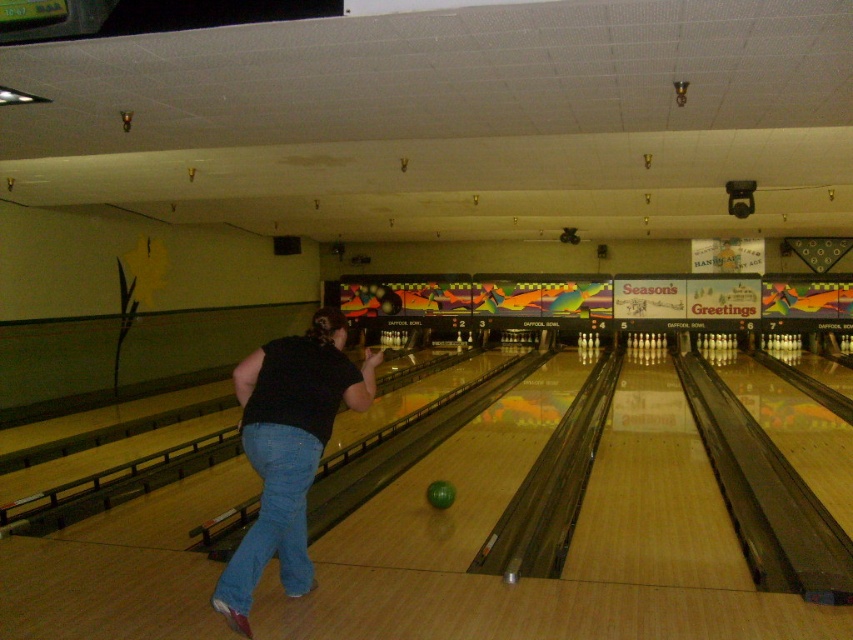
You are standing at the entrance of the bowling alley and see the point marked at coordinates (288, 449). What object is located at that point?

The point at coordinates (288, 449) corresponds to the black cotton shirt at center.

Based on the photo, you are a photographer standing at the end of the bowling lane. You notice the denim at left and the green matte bowling ball at center in your viewfinder. Which object should you zoom in on if you want to capture the larger object in detail?

The denim at left is larger than the green matte bowling ball at center, so you should zoom in on the denim at left to capture the larger object in detail.

You are a bowler standing at the center of the lane. You want to pick up the green matte bowling ball at center but there is a black cotton shirt at center in your way. Can you reach the ball without moving the shirt?

The black cotton shirt at center is 1.92 meters away from the green matte bowling ball at center, so you can reach the ball without moving the shirt since the distance is manageable.